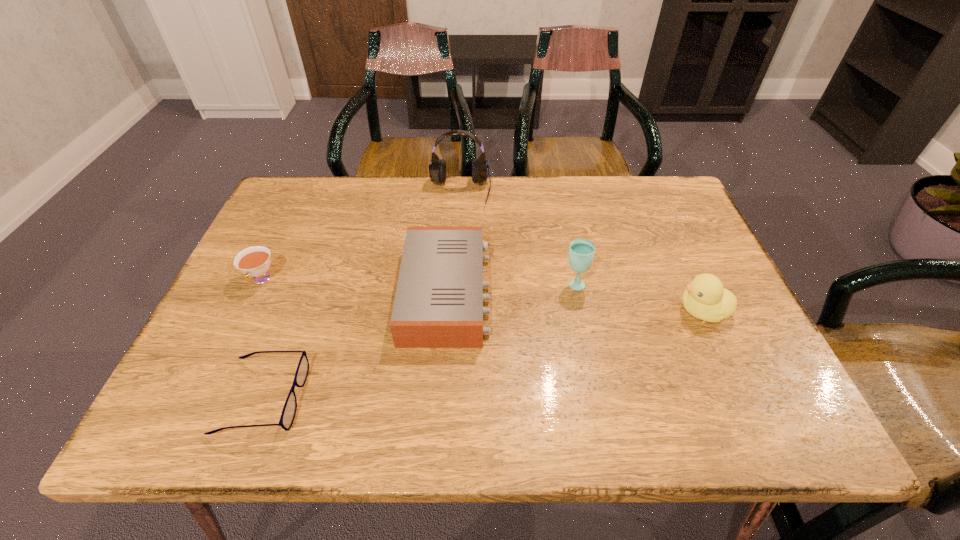
The height and width of the screenshot is (540, 960). I want to click on vacant space that satisfies the following two spatial constraints: 1. on the ear cushions of the glass; 2. on the left side of the farthest object, so click(x=455, y=284).

Where is `vacant position in the image that satisfies the following two spatial constraints: 1. on the front side of the glass; 2. on the front-facing side of the spectacles`? The width and height of the screenshot is (960, 540). vacant position in the image that satisfies the following two spatial constraints: 1. on the front side of the glass; 2. on the front-facing side of the spectacles is located at coordinates (598, 397).